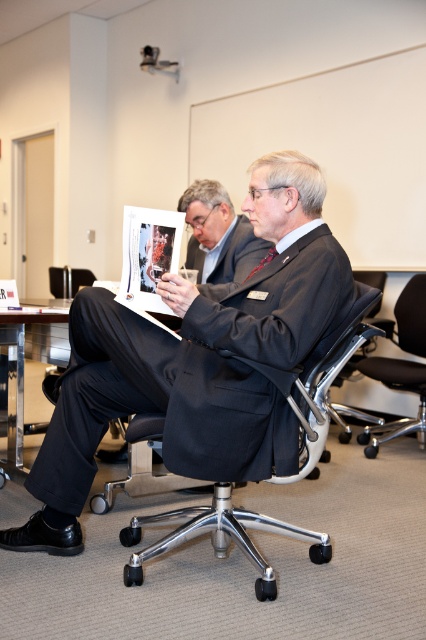
Question: Does white paper at center appear on the left side of metallic polished table at lower left?

Choices:
 (A) yes
 (B) no

Answer: (B)

Question: Which of the following is the closest to the observer?

Choices:
 (A) black matte suit at center
 (B) white paper at center

Answer: (B)

Question: Observing the image, what is the correct spatial positioning of matte black suit at center in reference to white paper at center?

Choices:
 (A) left
 (B) right

Answer: (B)

Question: Which of the following is the farthest from the observer?

Choices:
 (A) black mesh swivel chair at center
 (B) white paper at center
 (C) black matte suit at center

Answer: (A)

Question: Which object is closer to the camera taking this photo?

Choices:
 (A) metallic silver swivel chair at center
 (B) black mesh swivel chair at center
 (C) black matte suit at center
 (D) metallic polished table at lower left

Answer: (A)

Question: Is matte black suit at center thinner than metallic silver swivel chair at center?

Choices:
 (A) no
 (B) yes

Answer: (A)